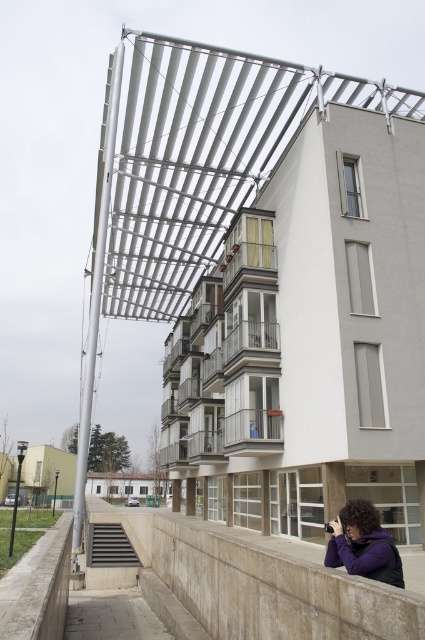
You are standing in front of the modern residential building and want to take a photo. There are two points marked on the building facade at coordinates point (x=319, y=630) and point (x=328, y=561). Which of these two points is closer to your current position?

Point (x=319, y=630) is closer to the viewer than point (x=328, y=561), so the point at coordinates point (x=319, y=630) is closer to your current position.

You are a photographer trying to capture the architectural details of the building. You have a purple fleece jacket at lower center and a concrete ledge at lower center in your frame. Which object should you focus on if you want to emphasize a larger subject in your photo?

The concrete ledge at lower center is larger in size than the purple fleece jacket at lower center, so focusing on the concrete ledge at lower center would emphasize a larger subject in your photo.